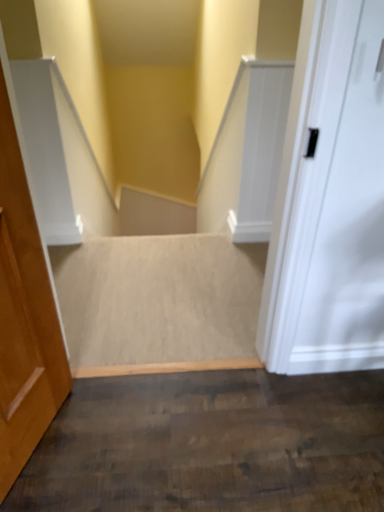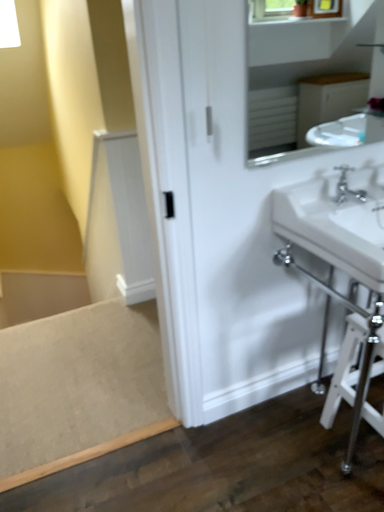
Question: Which way did the camera rotate in the video?

Choices:
 (A) rotated downward
 (B) rotated upward

Answer: (B)